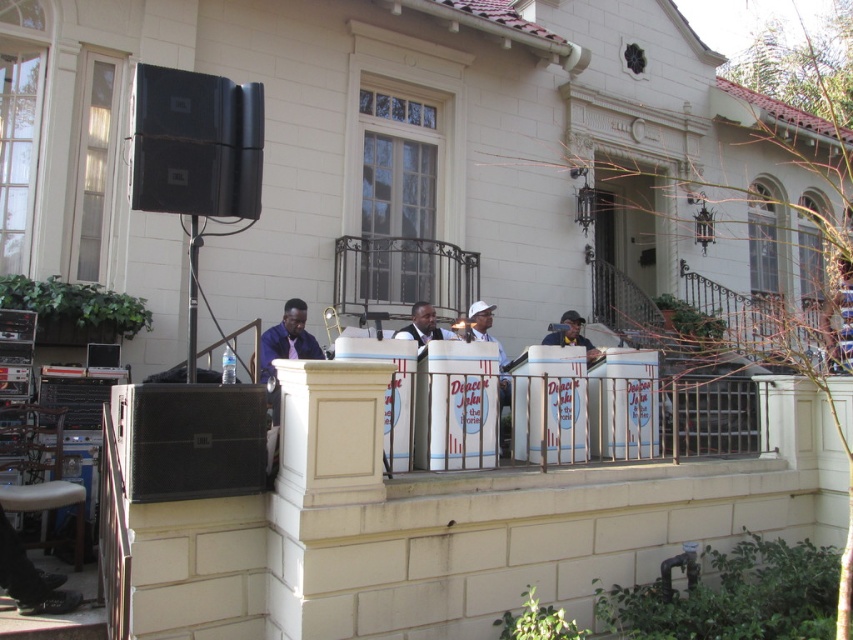
Measure the distance between point (505, 362) and camera.

They are 8.63 meters apart.

From the picture: Can you confirm if white matte baseball cap at center is taller than matte black speaker at center?

Yes, white matte baseball cap at center is taller than matte black speaker at center.

The height and width of the screenshot is (640, 853). Find the location of `white matte baseball cap at center`. white matte baseball cap at center is located at coordinates (482, 326).

Does white leather stool at lower left have a lesser height compared to blue fabric shirt at center?

Yes.

Is the position of white leather stool at lower left less distant than that of blue fabric shirt at center?

That is True.

Does point (44, 483) come closer to viewer compared to point (276, 339)?

Yes, it is in front of point (276, 339).

This screenshot has width=853, height=640. I want to click on white leather stool at lower left, so click(48, 504).

Is black matte speaker at lower left smaller than white matte baseball cap at center?

No.

Does black matte speaker at lower left have a greater height compared to white matte baseball cap at center?

Yes.

Where is `black matte speaker at lower left`? The height and width of the screenshot is (640, 853). black matte speaker at lower left is located at coordinates (190, 440).